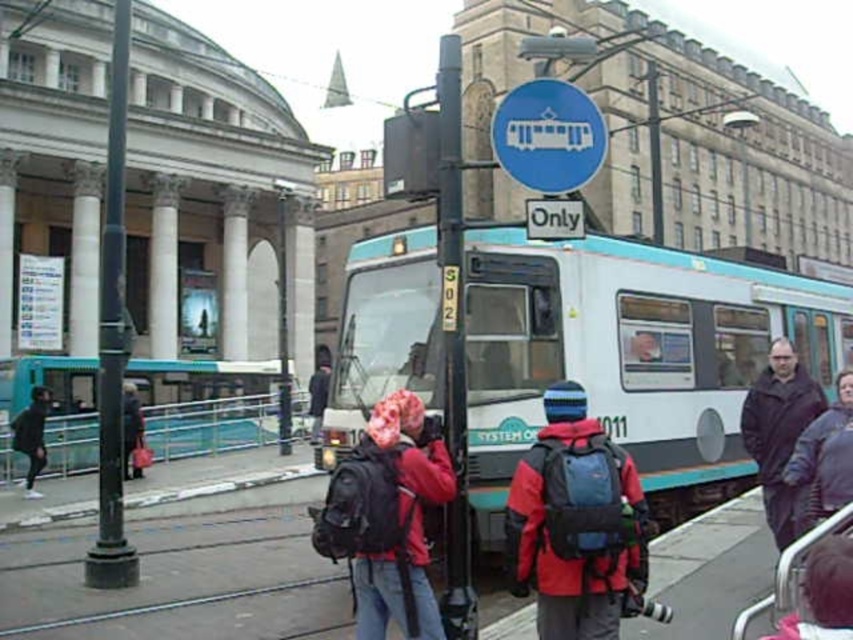
Question: Can you confirm if teal/white passenger train at center is smaller than matte red jacket at center?

Choices:
 (A) yes
 (B) no

Answer: (B)

Question: Which object is positioned closest to the teal/white passenger train at center?

Choices:
 (A) matte red jacket at center
 (B) dark brown leather jacket at right

Answer: (B)

Question: Does teal/white passenger train at center have a lesser width compared to dark brown leather jacket at right?

Choices:
 (A) no
 (B) yes

Answer: (A)

Question: Among these objects, which one is nearest to the camera?

Choices:
 (A) dark brown leather jacket at right
 (B) matte red jacket at center
 (C) teal/white passenger train at center

Answer: (B)

Question: Is matte red jacket at center to the left of dark brown leather jacket at right from the viewer's perspective?

Choices:
 (A) no
 (B) yes

Answer: (B)

Question: Which of these objects is positioned closest to the teal/white passenger train at center?

Choices:
 (A) matte red jacket at center
 (B) dark brown leather jacket at right

Answer: (B)